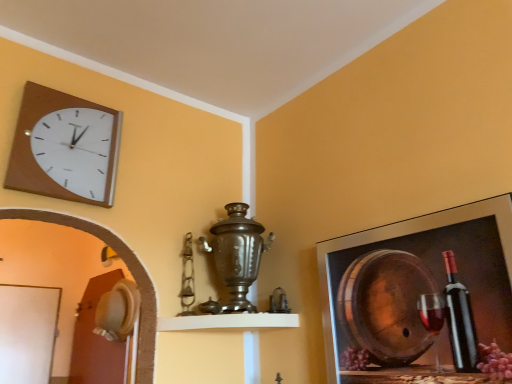
Question: Considering the relative positions of metallic frame at upper right and matte brown clock at upper left in the image provided, is metallic frame at upper right to the left of matte brown clock at upper left from the viewer's perspective?

Choices:
 (A) no
 (B) yes

Answer: (A)

Question: Is metallic frame at upper right completely or partially outside of matte brown clock at upper left?

Choices:
 (A) yes
 (B) no

Answer: (A)

Question: Considering the relative sizes of metallic frame at upper right and matte brown clock at upper left in the image provided, is metallic frame at upper right smaller than matte brown clock at upper left?

Choices:
 (A) no
 (B) yes

Answer: (A)

Question: From the image's perspective, would you say metallic frame at upper right is positioned over matte brown clock at upper left?

Choices:
 (A) no
 (B) yes

Answer: (A)

Question: From a real-world perspective, does metallic frame at upper right stand above matte brown clock at upper left?

Choices:
 (A) yes
 (B) no

Answer: (B)

Question: Is point coord(65,119) closer or farther from the camera than point coord(252,319)?

Choices:
 (A) closer
 (B) farther

Answer: (A)

Question: Looking at their shapes, would you say matte brown clock at upper left is wider or thinner than white matte shelf at center?

Choices:
 (A) thin
 (B) wide

Answer: (A)

Question: Is matte brown clock at upper left inside the boundaries of white matte shelf at center, or outside?

Choices:
 (A) outside
 (B) inside

Answer: (A)

Question: Relative to white matte shelf at center, is matte brown clock at upper left in front or behind?

Choices:
 (A) behind
 (B) front

Answer: (B)

Question: In the image, is white matte shelf at center on the left side or the right side of matte brown clock at upper left?

Choices:
 (A) left
 (B) right

Answer: (B)

Question: Considering the positions of white matte shelf at center and matte brown clock at upper left in the image, is white matte shelf at center wider or thinner than matte brown clock at upper left?

Choices:
 (A) thin
 (B) wide

Answer: (B)

Question: From the image's perspective, relative to matte brown clock at upper left, is white matte shelf at center above or below?

Choices:
 (A) above
 (B) below

Answer: (B)

Question: In terms of height, does white matte shelf at center look taller or shorter compared to matte brown clock at upper left?

Choices:
 (A) tall
 (B) short

Answer: (B)

Question: Is matte brown clock at upper left wider or thinner than metallic frame at upper right?

Choices:
 (A) wide
 (B) thin

Answer: (B)

Question: From the image's perspective, is matte brown clock at upper left located above or below metallic frame at upper right?

Choices:
 (A) above
 (B) below

Answer: (A)